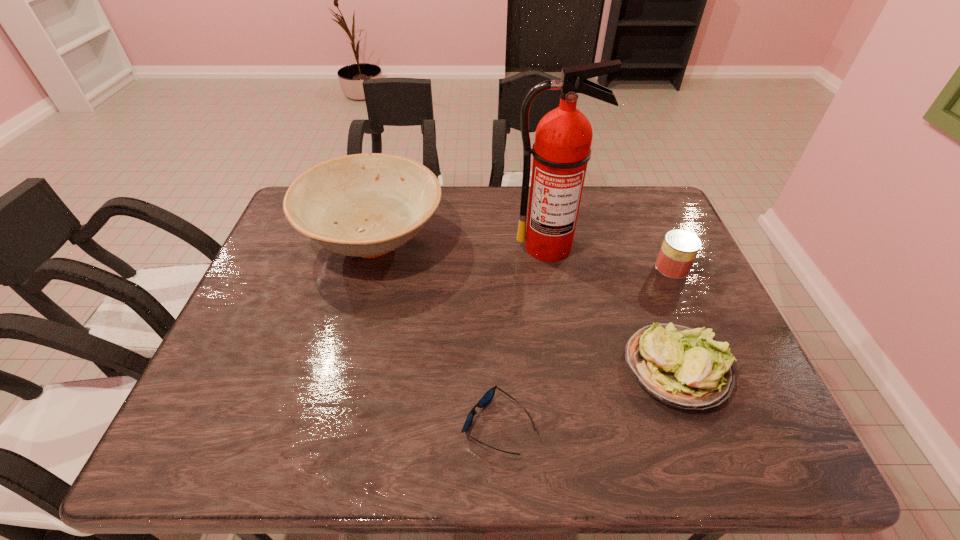
Where is `free region located 0.160m at the front of the shortest object showing the lenses`? free region located 0.160m at the front of the shortest object showing the lenses is located at coordinates (385, 425).

This screenshot has height=540, width=960. Find the location of `free spot located 0.320m at the front of the shortest object showing the lenses`. free spot located 0.320m at the front of the shortest object showing the lenses is located at coordinates [308, 425].

This screenshot has height=540, width=960. In order to click on vacant point located at the front of the shortest object showing the lenses in this screenshot , I will do `click(409, 425)`.

Locate an element on the screen. object at the far edge is located at coordinates (365, 205).

Where is `object at the near edge`? object at the near edge is located at coordinates (488, 396).

You are a GUI agent. You are given a task and a screenshot of the screen. Output one action in this format:
    pyautogui.click(x=<x>, y=<y>)
    Task: Click on the object that is positioned at the left edge
    This screenshot has width=960, height=540.
    Given the screenshot: What is the action you would take?
    pyautogui.click(x=365, y=205)

This screenshot has height=540, width=960. Find the location of `can at the right edge`. can at the right edge is located at coordinates (679, 249).

Where is `lettuce that is at the right edge`? The height and width of the screenshot is (540, 960). lettuce that is at the right edge is located at coordinates (681, 366).

You are a GUI agent. You are given a task and a screenshot of the screen. Output one action in this format:
    pyautogui.click(x=<x>, y=<y>)
    Task: Click on the object that is at the far left corner
    The width and height of the screenshot is (960, 540).
    Given the screenshot: What is the action you would take?
    pyautogui.click(x=365, y=205)

Locate an element on the screen. This screenshot has width=960, height=540. vacant position at the far edge of the desktop is located at coordinates (600, 212).